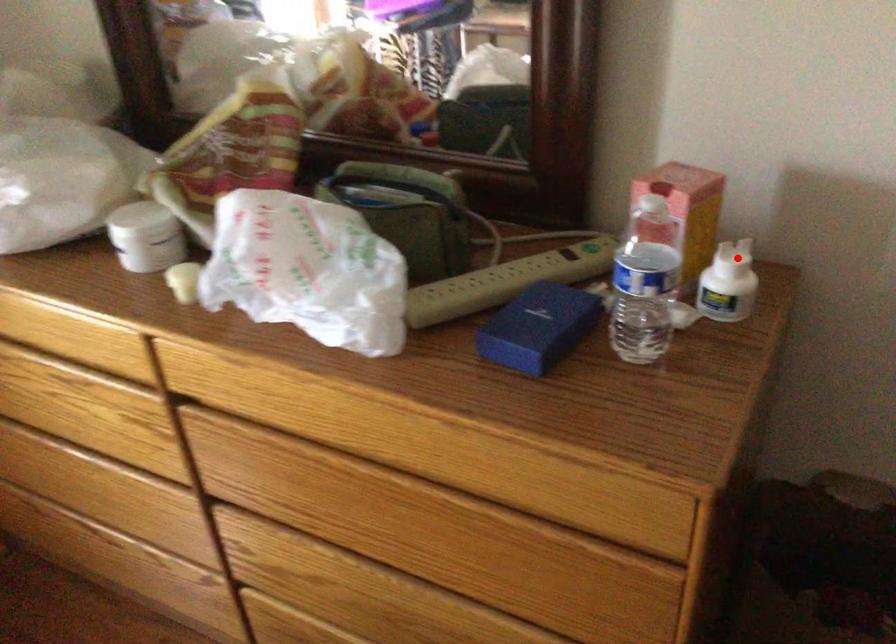
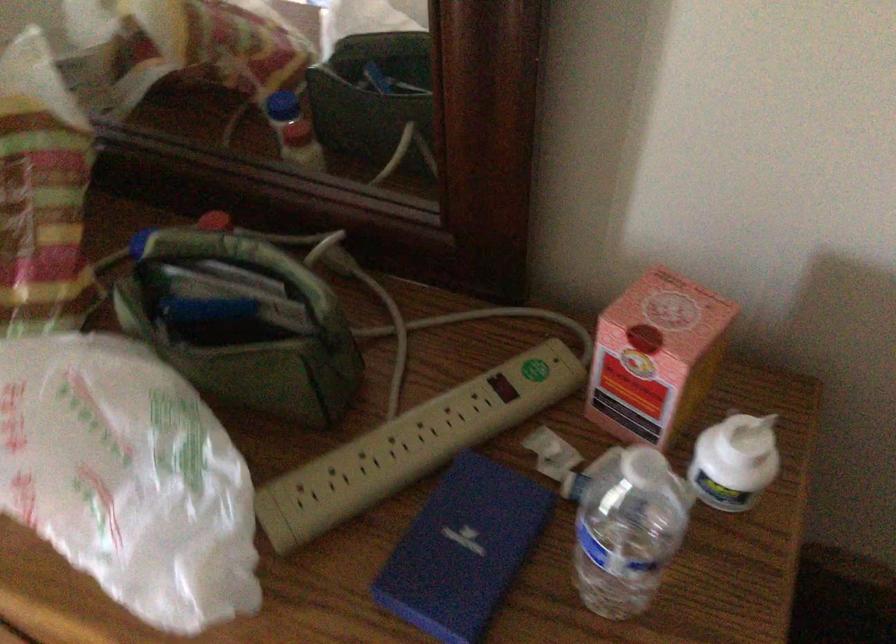
Question: A red point is marked in image1. In image2, is the corresponding 3D point closer to the camera or farther? Reply with the corresponding letter.

Choices:
 (A) The corresponding 3D point is closer.
 (B) The corresponding 3D point is farther.

Answer: (A)